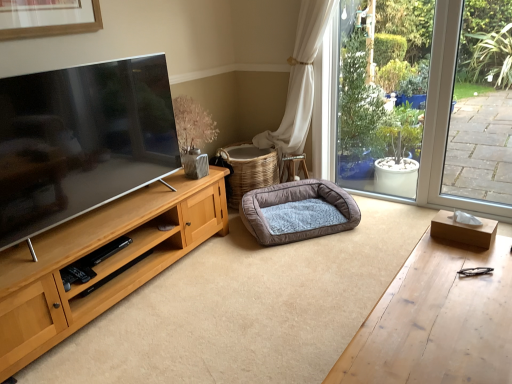
Question: Is woven brown basket at center positioned far away from wooden desk at lower right?

Choices:
 (A) no
 (B) yes

Answer: (B)

Question: Does woven brown basket at center touch wooden desk at lower right?

Choices:
 (A) yes
 (B) no

Answer: (B)

Question: From the image's perspective, is woven brown basket at center on wooden desk at lower right?

Choices:
 (A) yes
 (B) no

Answer: (A)

Question: Does woven brown basket at center have a greater width compared to wooden desk at lower right?

Choices:
 (A) yes
 (B) no

Answer: (A)

Question: Is woven brown basket at center thinner than wooden desk at lower right?

Choices:
 (A) yes
 (B) no

Answer: (B)

Question: Does woven brown basket at center appear on the left side of wooden desk at lower right?

Choices:
 (A) no
 (B) yes

Answer: (B)

Question: Can you confirm if brown plush dog bed at center is bigger than wooden desk at lower right?

Choices:
 (A) yes
 (B) no

Answer: (B)

Question: Is brown plush dog bed at center at the right side of wooden desk at lower right?

Choices:
 (A) yes
 (B) no

Answer: (B)

Question: From the image's perspective, does brown plush dog bed at center appear higher than wooden desk at lower right?

Choices:
 (A) no
 (B) yes

Answer: (B)

Question: Can you confirm if brown plush dog bed at center is taller than wooden desk at lower right?

Choices:
 (A) no
 (B) yes

Answer: (A)

Question: Considering the relative sizes of brown plush dog bed at center and wooden desk at lower right in the image provided, is brown plush dog bed at center thinner than wooden desk at lower right?

Choices:
 (A) no
 (B) yes

Answer: (A)

Question: Is brown plush dog bed at center facing towards wooden desk at lower right?

Choices:
 (A) yes
 (B) no

Answer: (A)

Question: Is wooden desk at lower right not close to woven brown basket at center?

Choices:
 (A) no
 (B) yes

Answer: (B)